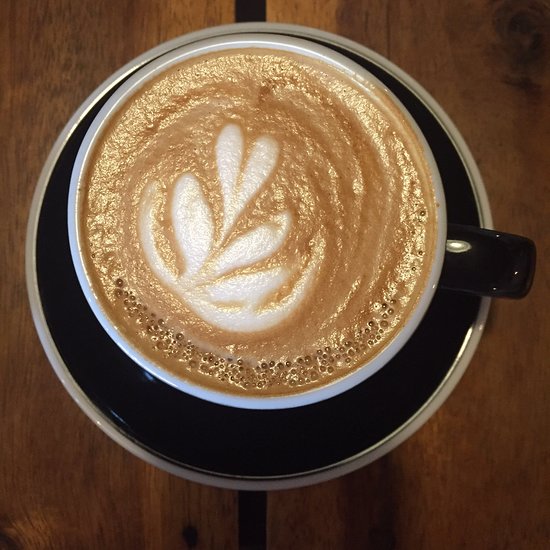
Find the location of a particular element. The width and height of the screenshot is (550, 550). light spot on table is located at coordinates (302, 11), (216, 21).